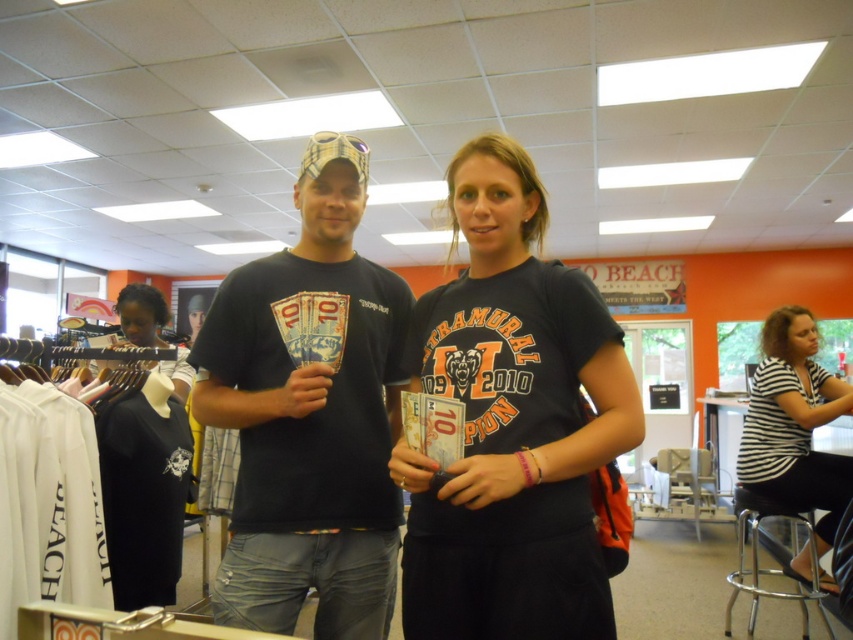
Can you confirm if striped cotton shirt at center is positioned to the left of clear plastic stool at lower right?

Correct, you'll find striped cotton shirt at center to the left of clear plastic stool at lower right.

Between striped cotton shirt at center and clear plastic stool at lower right, which one is positioned higher?

striped cotton shirt at center

Locate an element on the screen. The image size is (853, 640). striped cotton shirt at center is located at coordinates (793, 424).

Can you confirm if black cotton t-shirt at center is wider than clear plastic stool at lower right?

No, black cotton t-shirt at center is not wider than clear plastic stool at lower right.

Image resolution: width=853 pixels, height=640 pixels. What do you see at coordinates (511, 422) in the screenshot?
I see `black cotton t-shirt at center` at bounding box center [511, 422].

Where is `black cotton t-shirt at center`? black cotton t-shirt at center is located at coordinates (511, 422).

You are a GUI agent. You are given a task and a screenshot of the screen. Output one action in this format:
    pyautogui.click(x=<x>, y=<y>)
    Task: Click on the black cotton t-shirt at center
    The height and width of the screenshot is (640, 853).
    Given the screenshot: What is the action you would take?
    pyautogui.click(x=511, y=422)

How much distance is there between black cotton t-shirt at center and striped cotton shirt at center?

black cotton t-shirt at center is 6.61 feet away from striped cotton shirt at center.

Is point (438, 595) positioned after point (778, 401)?

No, (438, 595) is closer to viewer.

Where is `black cotton t-shirt at center`? black cotton t-shirt at center is located at coordinates (511, 422).